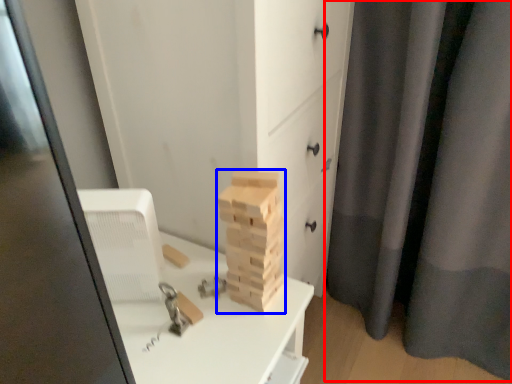
Question: Among these objects, which one is nearest to the camera, curtain (highlighted by a red box) or drawer (highlighted by a blue box)?

Choices:
 (A) curtain
 (B) drawer

Answer: (B)